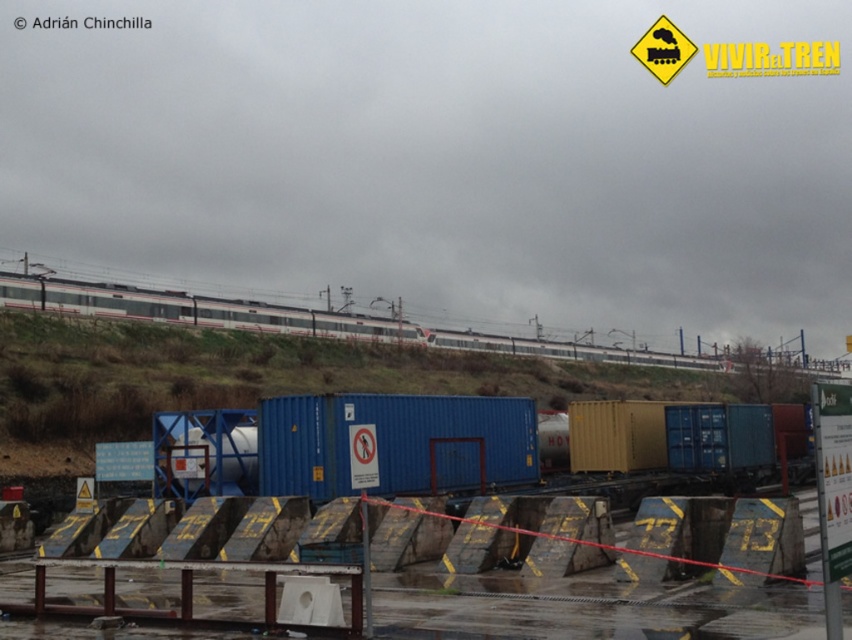
Does point (453, 444) come in front of point (711, 369)?

Yes, point (453, 444) is in front of point (711, 369).

Where is `blue metallic shipping container at center`? blue metallic shipping container at center is located at coordinates (394, 444).